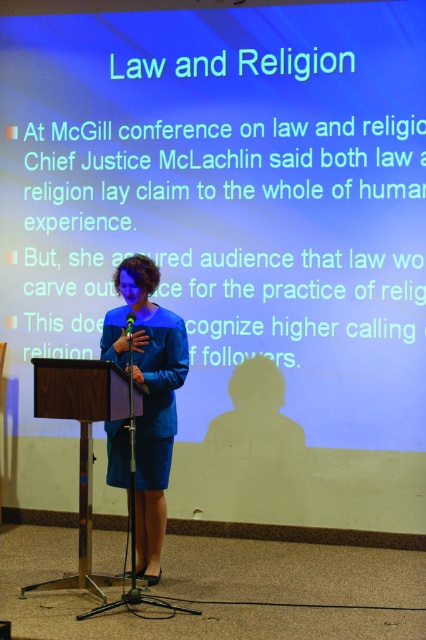
You are an attendee at the conference. You need to place a name tag on the wooden podium at center and the green plastic microphone at center. Which object should you place the name tag closer to the audience? Explain your reasoning based on their positions.

The wooden podium at center is in front of the green plastic microphone at center, so placing the name tag closer to the audience would be better on the wooden podium at center since it is positioned in front.

You are an event organizer who needs to ensure the speaker can move freely around the stage. Given the presence of the matte blue dress at center and the wooden podium at center, which object is taller and might obstruct the speaker from moving around easily?

The matte blue dress at center has a greater height compared to the wooden podium at center, so the matte blue dress at center is taller and might obstruct the speaker from moving around easily.